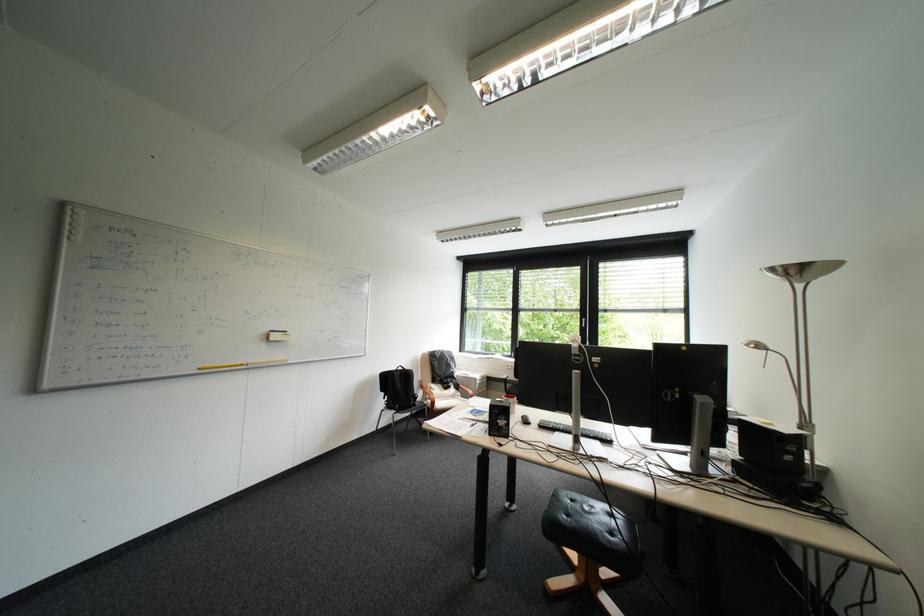
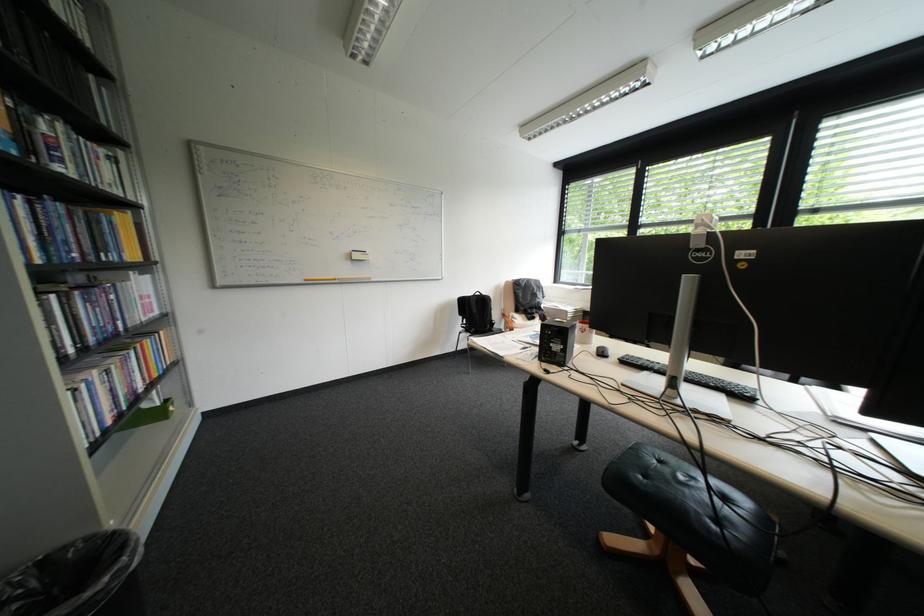
Question: The camera is either moving clockwise (left) or counter-clockwise (right) around the object. The first image is from the beginning of the video and the second image is from the end. Is the camera moving left or right when shooting the video?

Choices:
 (A) Left
 (B) Right

Answer: (B)